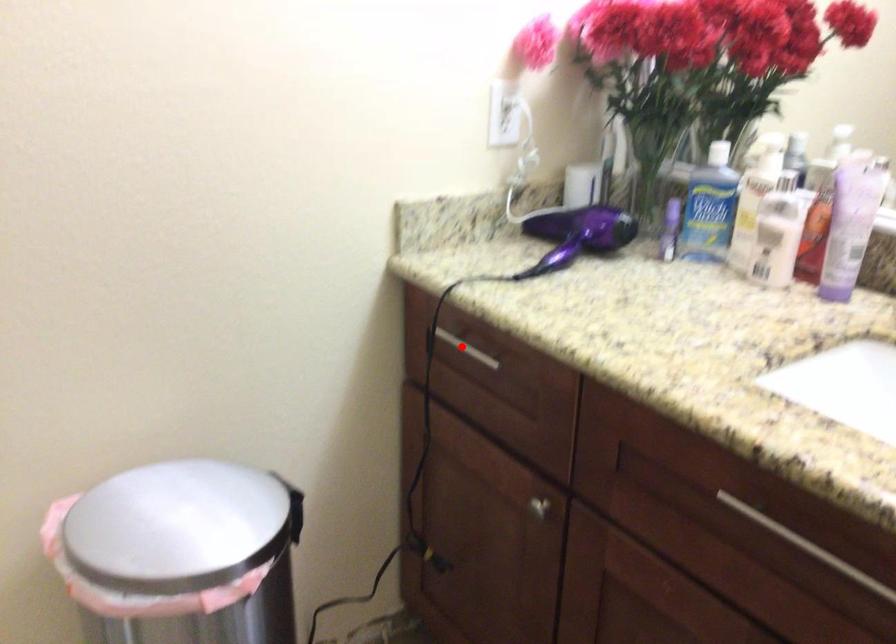
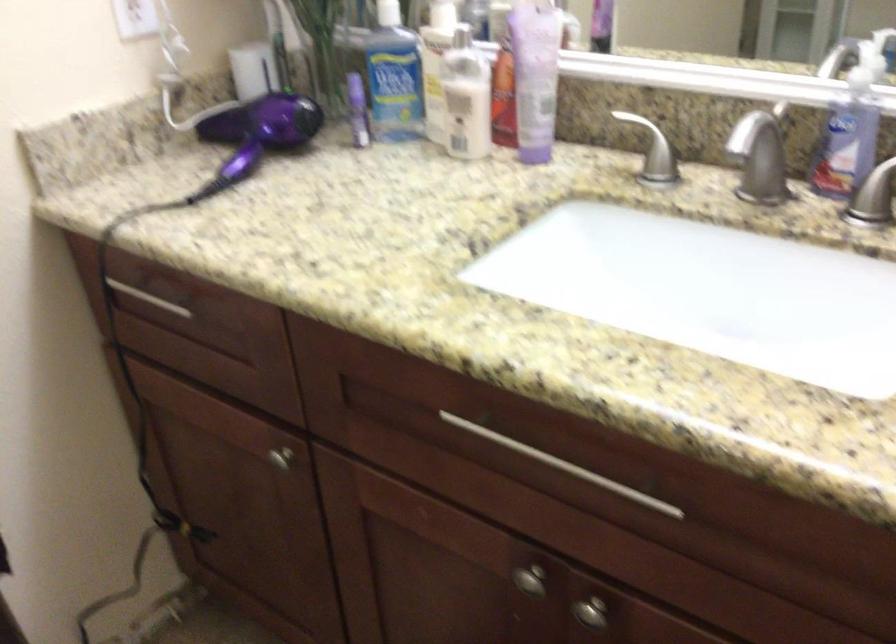
Question: I am providing you with two images of the same scene from different viewpoints. Given a red point in image1, look at the same physical point in image2. Is it:

Choices:
 (A) Closer to the viewpoint
 (B) Farther from the viewpoint

Answer: (A)